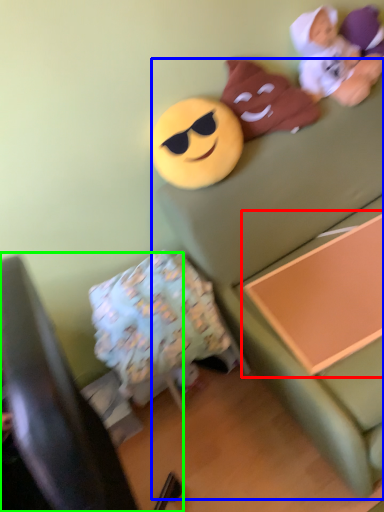
Question: Which object is positioned closest to changing table (highlighted by a red box)? Select from couch (highlighted by a blue box) and furniture (highlighted by a green box).

Choices:
 (A) couch
 (B) furniture

Answer: (A)